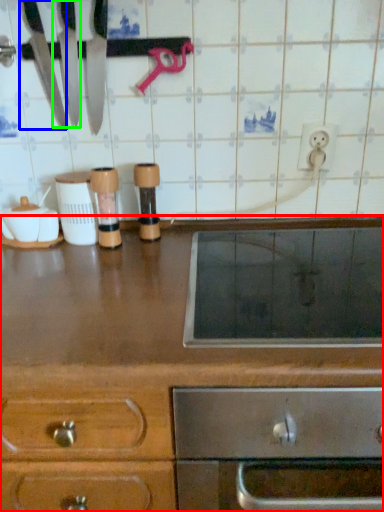
Question: Which object is positioned farthest from cabinetry (highlighted by a red box)? Select from knife (highlighted by a blue box) and knife (highlighted by a green box).

Choices:
 (A) knife
 (B) knife

Answer: (A)